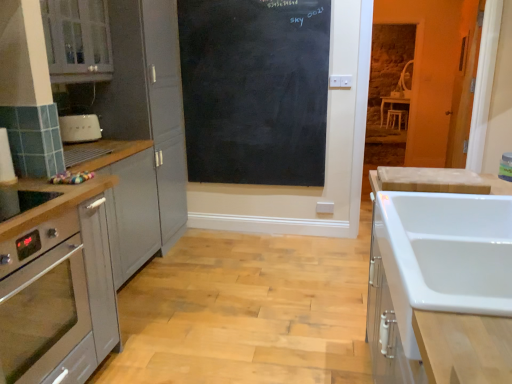
What do you see at coordinates (439, 282) in the screenshot?
I see `white glossy sink at right, arranged as the 3th cabinetry when viewed from the left` at bounding box center [439, 282].

What is the approximate height of satin silver cabinet at left, the 2th cabinetry from the right?

36.06 inches.

This screenshot has height=384, width=512. What do you see at coordinates (255, 90) in the screenshot?
I see `black chalkboard at center` at bounding box center [255, 90].

In order to click on orange matte door at upper right in this screenshot , I will do `click(464, 83)`.

Considering the relative sizes of clear plastic bottle at upper right, the first appliance from the bottom, and white matte toaster at left, the 1th appliance in the back-to-front sequence, in the image provided, is clear plastic bottle at upper right, the first appliance from the bottom, wider than white matte toaster at left, the 1th appliance in the back-to-front sequence,?

No, clear plastic bottle at upper right, the first appliance from the bottom, is not wider than white matte toaster at left, the 1th appliance in the back-to-front sequence.

I want to click on appliance that is above the clear plastic bottle at upper right, the first appliance positioned from the right (from the image's perspective), so click(80, 128).

From the image's perspective, between clear plastic bottle at upper right, the first appliance from the bottom, and white matte toaster at left, the second appliance in the bottom-to-top sequence, which one is located above?

From the image's view, white matte toaster at left, the second appliance in the bottom-to-top sequence, is above.

From a real-world perspective, is white glossy sink at right, arranged as the 3th cabinetry when viewed from the left, over orange matte door at upper right?

Incorrect, from a real-world perspective, white glossy sink at right, arranged as the 3th cabinetry when viewed from the left, is lower than orange matte door at upper right.

What's the angular difference between white glossy sink at right, arranged as the 3th cabinetry when viewed from the left, and orange matte door at upper right's facing directions?

The facing directions of white glossy sink at right, arranged as the 3th cabinetry when viewed from the left, and orange matte door at upper right are 95.5 degrees apart.

Consider the image. Is white glossy sink at right, which appears as the first cabinetry when viewed from the right, to the left or to the right of orange matte door at upper right in the image?

In the image, white glossy sink at right, which appears as the first cabinetry when viewed from the right, appears on the left side of orange matte door at upper right.

Identify the location of the 3rd cabinetry in front when counting from the orange matte door at upper right. The height and width of the screenshot is (384, 512). (439, 282).

How distant is orange matte door at upper right from white glossy sink at right, which appears as the first cabinetry when viewed from the right?

They are 8.11 feet apart.

You are a GUI agent. You are given a task and a screenshot of the screen. Output one action in this format:
    pyautogui.click(x=<x>, y=<y>)
    Task: Click on the door located above the white glossy sink at right, which appears as the first cabinetry when viewed from the right (from a real-world perspective)
    The image size is (512, 384).
    Given the screenshot: What is the action you would take?
    pyautogui.click(x=464, y=83)

From a real-world perspective, between orange matte door at upper right and white glossy sink at right, which appears as the first cabinetry when viewed from the right, who is vertically higher?

In real-world perspective, orange matte door at upper right is above.

Between orange matte door at upper right and white glossy sink at right, arranged as the 3th cabinetry when viewed from the left, which one has smaller size?

orange matte door at upper right is smaller.

Are orange matte door at upper right and satin silver cabinet at left, the second cabinetry viewed from the left, located far from each other?

Yes, orange matte door at upper right and satin silver cabinet at left, the second cabinetry viewed from the left, are located far from each other.

Would you say satin silver cabinet at left, the second cabinetry viewed from the left, is part of orange matte door at upper right's contents?

No, orange matte door at upper right does not contain satin silver cabinet at left, the second cabinetry viewed from the left.

From the image's perspective, is orange matte door at upper right under satin silver cabinet at left, the 2th cabinetry from the right?

No, from the image's perspective, orange matte door at upper right is not beneath satin silver cabinet at left, the 2th cabinetry from the right.

Visually, is orange matte door at upper right positioned to the left or to the right of satin silver cabinet at left, the 2th cabinetry from the right?

orange matte door at upper right is to the right of satin silver cabinet at left, the 2th cabinetry from the right.

From the image's perspective, relative to matte gray cabinet at upper left, the third cabinetry when ordered from right to left, is clear plastic bottle at upper right, the first appliance from the bottom, above or below?

Based on their image positions, clear plastic bottle at upper right, the first appliance from the bottom, is located beneath matte gray cabinet at upper left, the third cabinetry when ordered from right to left.

Is clear plastic bottle at upper right, the first appliance from the bottom, facing away from matte gray cabinet at upper left, which is the 1th cabinetry in left-to-right order?

Absolutely, clear plastic bottle at upper right, the first appliance from the bottom, is directed away from matte gray cabinet at upper left, which is the 1th cabinetry in left-to-right order.

In the scene shown: From a real-world perspective, is clear plastic bottle at upper right, the second appliance from the left, positioned over matte gray cabinet at upper left, which is the 1th cabinetry in left-to-right order, based on gravity?

Incorrect, from a real-world perspective, clear plastic bottle at upper right, the second appliance from the left, is lower than matte gray cabinet at upper left, which is the 1th cabinetry in left-to-right order.

Which appliance is the 2nd one when counting from the right side of the matte gray cabinet at upper left, the third cabinetry when ordered from right to left? Please provide its 2D coordinates.

[(506, 167)]

Considering the relative sizes of black chalkboard at center and matte gray cabinet at upper left, the third cabinetry when ordered from right to left, in the image provided, is black chalkboard at center smaller than matte gray cabinet at upper left, the third cabinetry when ordered from right to left,?

Yes, black chalkboard at center is smaller than matte gray cabinet at upper left, the third cabinetry when ordered from right to left.

Does black chalkboard at center contain matte gray cabinet at upper left, the third cabinetry when ordered from right to left?

No, matte gray cabinet at upper left, the third cabinetry when ordered from right to left, is not surrounded by black chalkboard at center.

Where is `bulletin board directly beneath the matte gray cabinet at upper left, the third cabinetry when ordered from right to left (from a real-world perspective)`? The height and width of the screenshot is (384, 512). bulletin board directly beneath the matte gray cabinet at upper left, the third cabinetry when ordered from right to left (from a real-world perspective) is located at coordinates (255, 90).

From a real-world perspective, between black chalkboard at center and matte gray cabinet at upper left, the third cabinetry when ordered from right to left, who is vertically lower?

In real-world perspective, black chalkboard at center is lower.

From the image's perspective, is white glossy sink at right, arranged as the 3th cabinetry when viewed from the left, above or below satin silver cabinet at left, the 2th cabinetry from the right?

Clearly, from the image's perspective, white glossy sink at right, arranged as the 3th cabinetry when viewed from the left, is below satin silver cabinet at left, the 2th cabinetry from the right.

Does white glossy sink at right, arranged as the 3th cabinetry when viewed from the left, turn towards satin silver cabinet at left, the second cabinetry viewed from the left?

No, white glossy sink at right, arranged as the 3th cabinetry when viewed from the left, is not turned towards satin silver cabinet at left, the second cabinetry viewed from the left.

Between white glossy sink at right, arranged as the 3th cabinetry when viewed from the left, and satin silver cabinet at left, the 2th cabinetry from the right, which one has smaller size?

Smaller between the two is satin silver cabinet at left, the 2th cabinetry from the right.

Considering the sizes of white glossy sink at right, which appears as the first cabinetry when viewed from the right, and satin silver cabinet at left, the second cabinetry viewed from the left, in the image, is white glossy sink at right, which appears as the first cabinetry when viewed from the right, wider or thinner than satin silver cabinet at left, the second cabinetry viewed from the left,?

Clearly, white glossy sink at right, which appears as the first cabinetry when viewed from the right, has less width compared to satin silver cabinet at left, the second cabinetry viewed from the left.

Find the location of a particular element. The width and height of the screenshot is (512, 384). appliance on the right of white matte toaster at left, placed as the second appliance when sorted from front to back is located at coordinates (506, 167).

From a real-world perspective, count 1st cabinetrys downward from the orange matte door at upper right and point to it. Please provide its 2D coordinates.

[(439, 282)]

Based on their spatial positions, is orange matte door at upper right or satin silver cabinet at left, the 2th cabinetry from the right, further from white marble countertop at right?

Among the two, satin silver cabinet at left, the 2th cabinetry from the right, is located further to white marble countertop at right.

Looking at the image, which one is located further to white glossy sink at right, arranged as the 3th cabinetry when viewed from the left, clear plastic bottle at upper right, the first appliance positioned from the right, or matte gray cabinet at upper left, the third cabinetry when ordered from right to left?

Based on the image, matte gray cabinet at upper left, the third cabinetry when ordered from right to left, appears to be further to white glossy sink at right, arranged as the 3th cabinetry when viewed from the left.

When comparing their distances from orange matte door at upper right, does white glossy sink at right, arranged as the 3th cabinetry when viewed from the left, or white marble countertop at right seem closer?

The object closer to orange matte door at upper right is white marble countertop at right.

Considering their positions, is matte gray cabinet at upper left, which is the 1th cabinetry in left-to-right order, positioned further to white marble countertop at right than clear plastic bottle at upper right, which is the 2th appliance in top-to-bottom order?

matte gray cabinet at upper left, which is the 1th cabinetry in left-to-right order.

Considering their positions, is white glossy sink at right, which appears as the first cabinetry when viewed from the right, positioned closer to satin silver cabinet at left, the second cabinetry viewed from the left, than black chalkboard at center?

white glossy sink at right, which appears as the first cabinetry when viewed from the right, lies closer to satin silver cabinet at left, the second cabinetry viewed from the left, than the other object.

From the image, which object appears to be nearer to white glossy sink at right, arranged as the 3th cabinetry when viewed from the left, white matte toaster at left, arranged as the 1th appliance when viewed from the left, or orange matte door at upper right?

Based on the image, white matte toaster at left, arranged as the 1th appliance when viewed from the left, appears to be nearer to white glossy sink at right, arranged as the 3th cabinetry when viewed from the left.

Based on their spatial positions, is black chalkboard at center or matte gray cabinet at upper left, which is the 1th cabinetry in left-to-right order, closer to white glossy sink at right, which appears as the first cabinetry when viewed from the right?

Based on the image, matte gray cabinet at upper left, which is the 1th cabinetry in left-to-right order, appears to be nearer to white glossy sink at right, which appears as the first cabinetry when viewed from the right.

Looking at the image, which one is located further to white marble countertop at right, white matte toaster at left, placed as the 1th appliance when sorted from top to bottom, or orange matte door at upper right?

Among the two, white matte toaster at left, placed as the 1th appliance when sorted from top to bottom, is located further to white marble countertop at right.

Where is `bulletin board between matte gray cabinet at upper left, the third cabinetry when ordered from right to left, and white marble countertop at right`? This screenshot has height=384, width=512. bulletin board between matte gray cabinet at upper left, the third cabinetry when ordered from right to left, and white marble countertop at right is located at coordinates (255, 90).

The width and height of the screenshot is (512, 384). Identify the location of cabinetry between satin silver cabinet at left, the 2th cabinetry from the right, and white matte toaster at left, the second appliance positioned from the right, in the front-back direction. (77, 40).

Find the location of a particular element. cabinetry between white matte toaster at left, the 1th appliance in the back-to-front sequence, and white marble countertop at right, in the horizontal direction is located at coordinates (56, 285).

Locate an element on the screen. bulletin board situated between white matte toaster at left, the 1th appliance in the back-to-front sequence, and orange matte door at upper right from left to right is located at coordinates (255, 90).